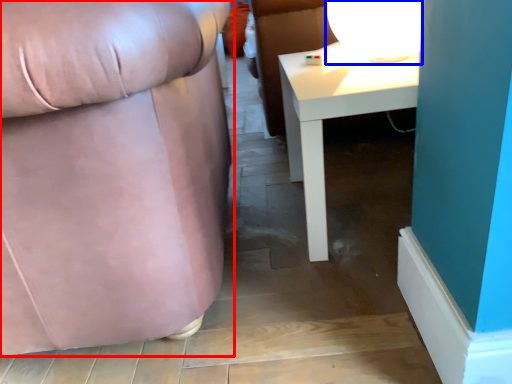
Question: Which of the following is the farthest to the observer, chair (highlighted by a red box) or table lamp (highlighted by a blue box)?

Choices:
 (A) chair
 (B) table lamp

Answer: (B)